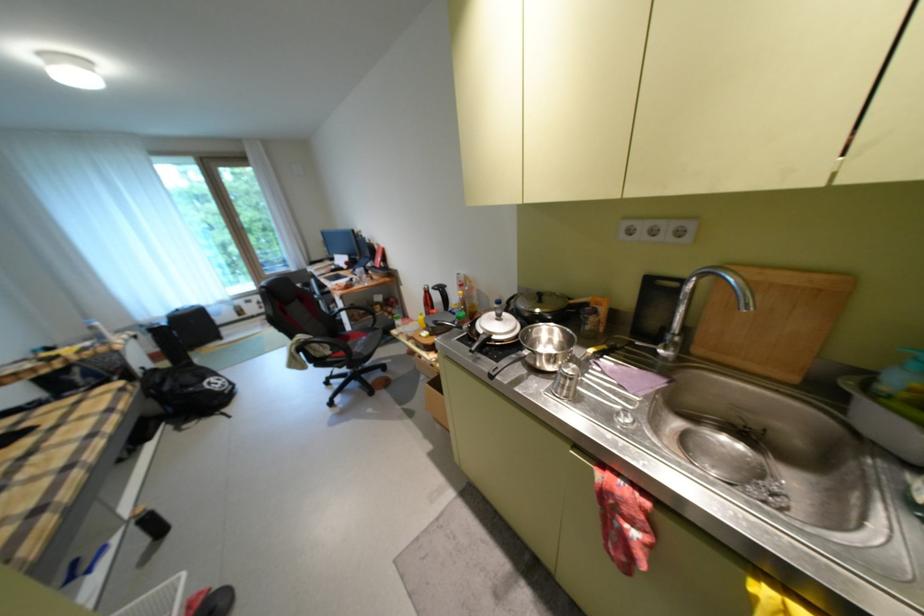
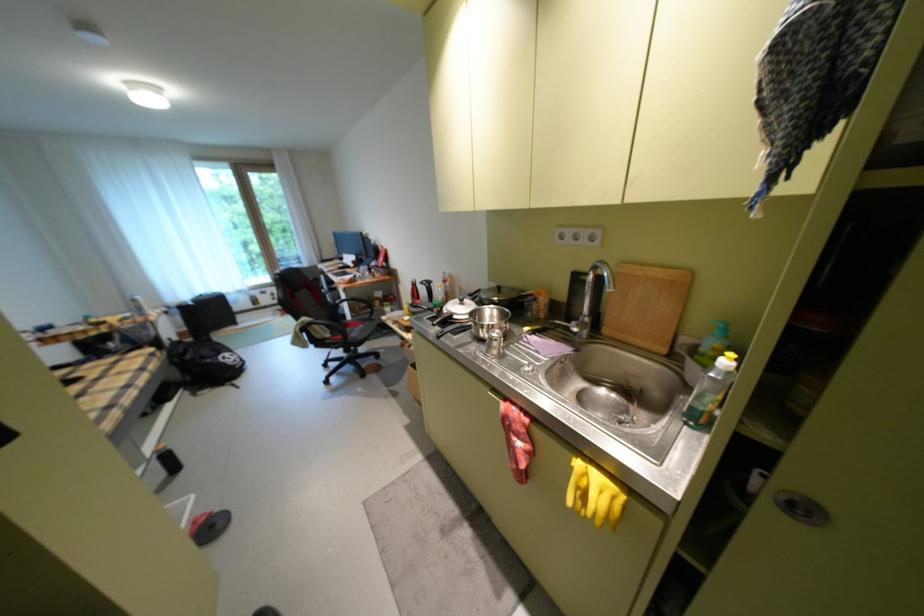
The point at (264, 302) is marked in the first image. Where is the corresponding point in the second image?

(280, 294)